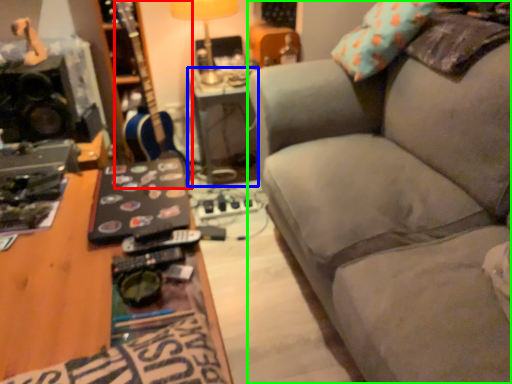
Question: Which object is positioned closest to guitar (highlighted by a red box)? Select from table (highlighted by a blue box) and studio couch (highlighted by a green box).

Choices:
 (A) table
 (B) studio couch

Answer: (A)